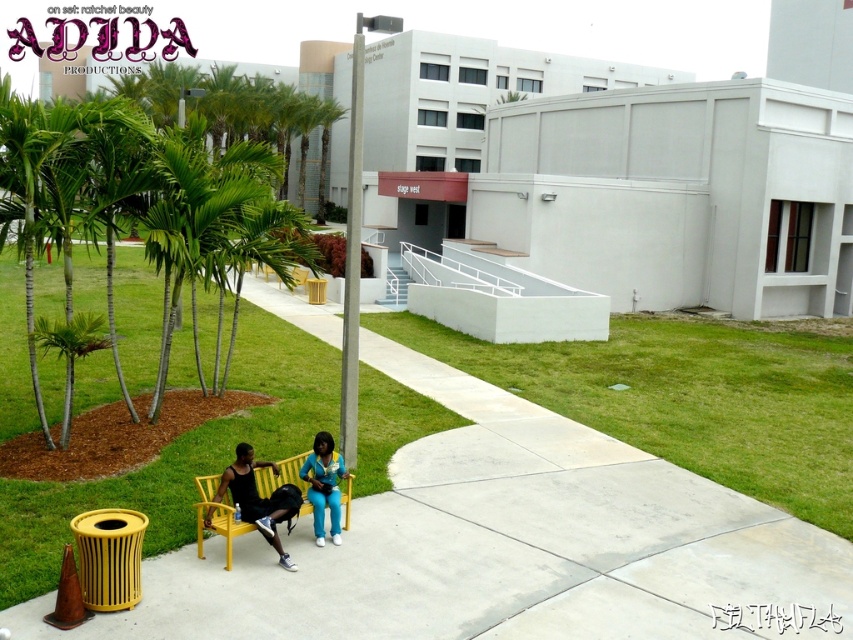
Question: Which of the following is the closest to the observer?

Choices:
 (A) green grass at lower left
 (B) yellow concrete bench at lower center
 (C) yellow painted wood bench at center

Answer: (A)

Question: Based on their relative distances, which object is nearer to the blue fabric jacket at center?

Choices:
 (A) yellow concrete bench at lower center
 (B) yellow painted wood bench at center
 (C) green grass at lower left

Answer: (B)

Question: Can you confirm if yellow concrete bench at lower center is wider than yellow painted wood bench at center?

Choices:
 (A) no
 (B) yes

Answer: (A)

Question: Does blue fabric jacket at center appear over yellow painted wood bench at center?

Choices:
 (A) no
 (B) yes

Answer: (B)

Question: Is yellow concrete bench at lower center smaller than green grass at lower left?

Choices:
 (A) yes
 (B) no

Answer: (A)

Question: Which of the following is the farthest from the observer?

Choices:
 (A) yellow concrete bench at lower center
 (B) blue fabric jacket at center
 (C) green grass at lower left
 (D) yellow painted wood bench at center

Answer: (B)